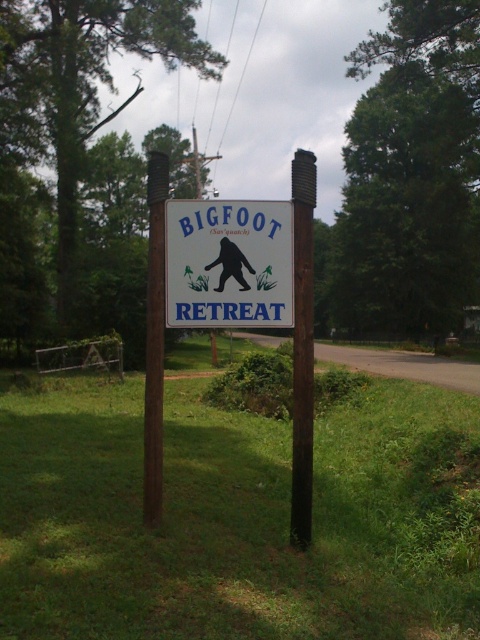
Can you confirm if blue plastic sign at center is wider than brown wood post at center?

Yes, blue plastic sign at center is wider than brown wood post at center.

The height and width of the screenshot is (640, 480). Describe the element at coordinates (228, 262) in the screenshot. I see `blue plastic sign at center` at that location.

The width and height of the screenshot is (480, 640). I want to click on blue plastic sign at center, so click(x=228, y=262).

Where is `blue plastic sign at center`? blue plastic sign at center is located at coordinates 228,262.

Which is more to the right, brown wood post at center or brown wooden post at center?

brown wood post at center

Which of these two, brown wood post at center or brown wooden post at center, stands taller?

Standing taller between the two is brown wood post at center.

I want to click on brown wood post at center, so click(302, 348).

You are a GUI agent. You are given a task and a screenshot of the screen. Output one action in this format:
    pyautogui.click(x=<x>, y=<y>)
    Task: Click on the blue plastic sign at center
    
    Given the screenshot: What is the action you would take?
    pyautogui.click(x=228, y=262)

This screenshot has width=480, height=640. What do you see at coordinates (228, 262) in the screenshot? I see `blue plastic sign at center` at bounding box center [228, 262].

Between point (240, 321) and point (158, 259), which one is positioned behind?

The point (240, 321) is behind.

Identify the location of blue plastic sign at center. The image size is (480, 640). (228, 262).